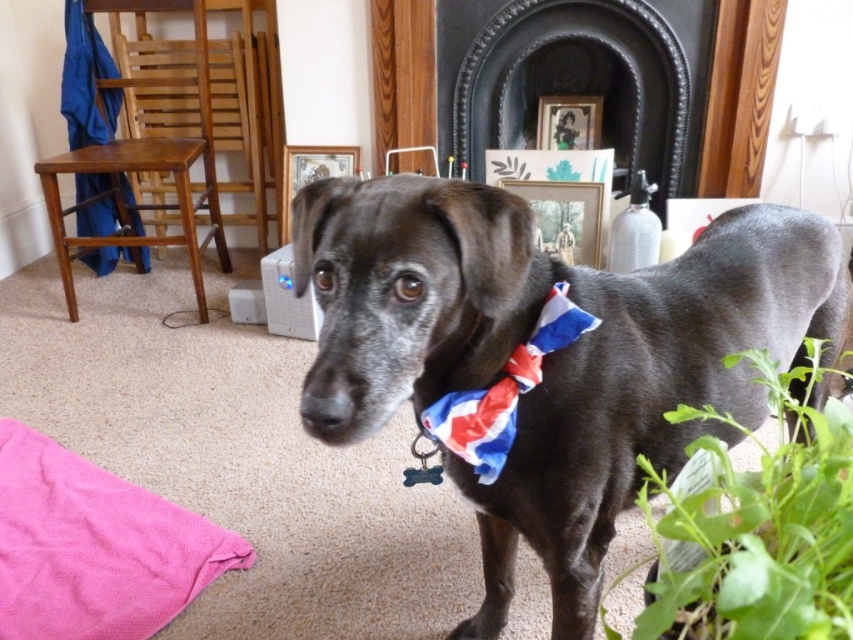
Question: Based on their relative distances, which object is nearer to the union jack fabric bow tie at center?

Choices:
 (A) green leafy plant at lower right
 (B) black matte fireplace at upper center

Answer: (A)

Question: Which of the following is the closest to the observer?

Choices:
 (A) union jack fabric bow tie at center
 (B) shiny black dog at center
 (C) green leafy plant at lower right
 (D) black matte fireplace at upper center

Answer: (C)

Question: Does shiny black dog at center appear over green leafy plant at lower right?

Choices:
 (A) yes
 (B) no

Answer: (B)

Question: Is green leafy plant at lower right below union jack fabric bow tie at center?

Choices:
 (A) no
 (B) yes

Answer: (B)

Question: In this image, where is shiny black dog at center located relative to black matte fireplace at upper center?

Choices:
 (A) above
 (B) below

Answer: (B)

Question: Which point is closer to the camera?

Choices:
 (A) union jack fabric bow tie at center
 (B) black matte fireplace at upper center

Answer: (A)